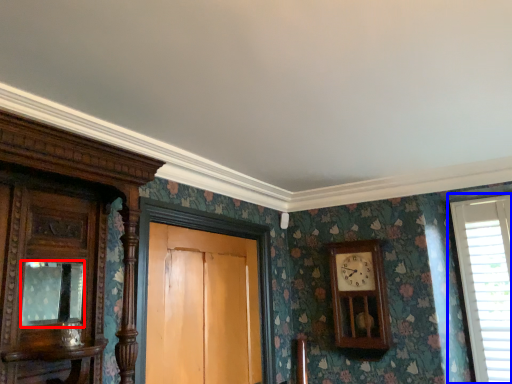
Question: Which object appears farthest to the camera in this image, mirror (highlighted by a red box) or window (highlighted by a blue box)?

Choices:
 (A) mirror
 (B) window

Answer: (B)